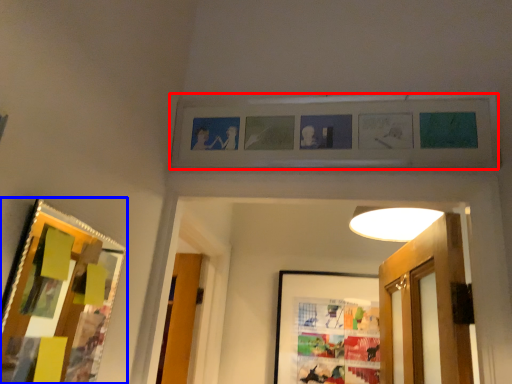
Question: Which object appears farthest to the camera in this image, picture frame (highlighted by a red box) or picture frame (highlighted by a blue box)?

Choices:
 (A) picture frame
 (B) picture frame

Answer: (A)